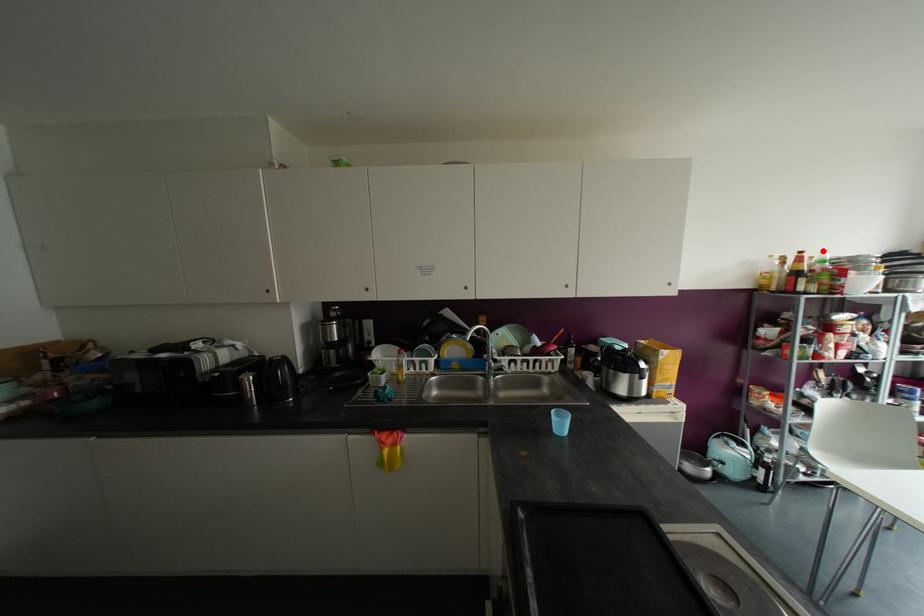
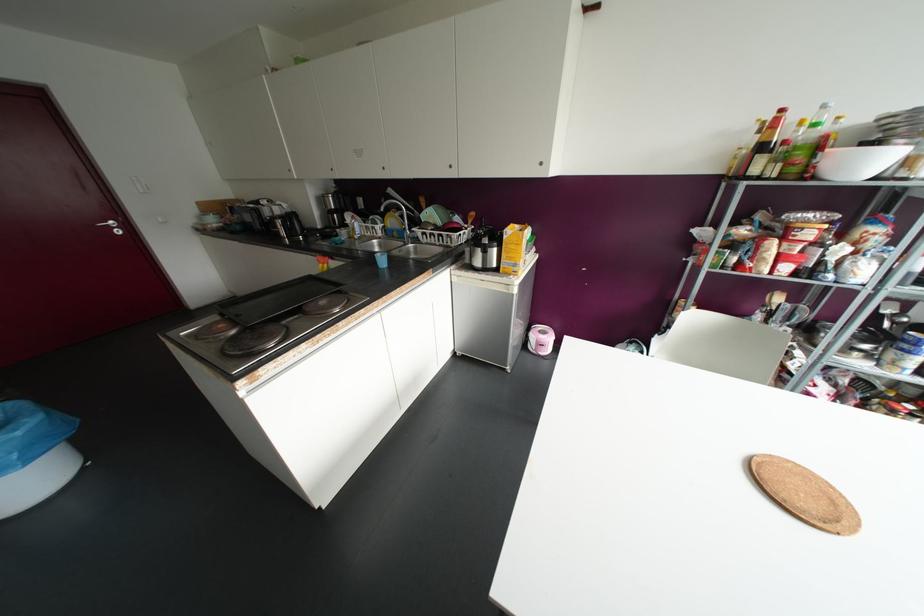
Question: I am providing you with two images of the same scene from different viewpoints. Given a red point in image1, look at the same physical point in image2. Is it:

Choices:
 (A) Closer to the viewpoint
 (B) Farther from the viewpoint

Answer: (B)